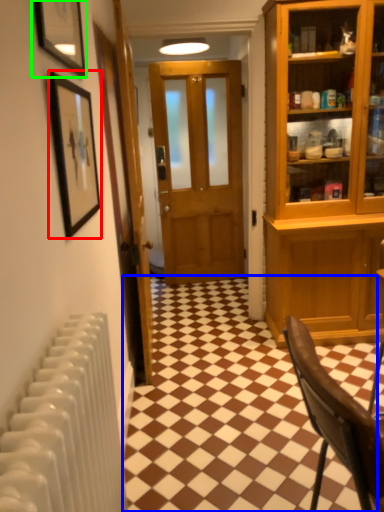
Question: Which object is the closest to the picture frame (highlighted by a red box)? Choose among these: tile (highlighted by a blue box) or picture frame (highlighted by a green box).

Choices:
 (A) tile
 (B) picture frame

Answer: (B)